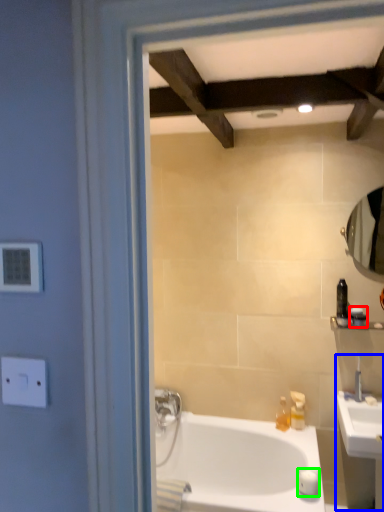
Question: Which object is positioned closest to toiletry (highlighted by a red box)? Select from sink (highlighted by a blue box) and soap (highlighted by a green box).

Choices:
 (A) sink
 (B) soap

Answer: (A)